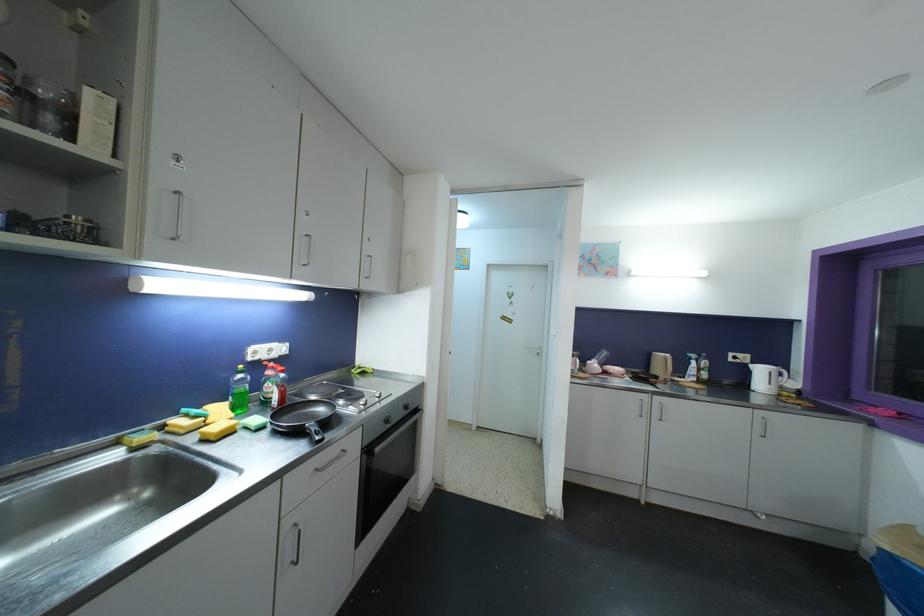
This screenshot has height=616, width=924. Describe the element at coordinates (737, 358) in the screenshot. I see `the kettle power switch` at that location.